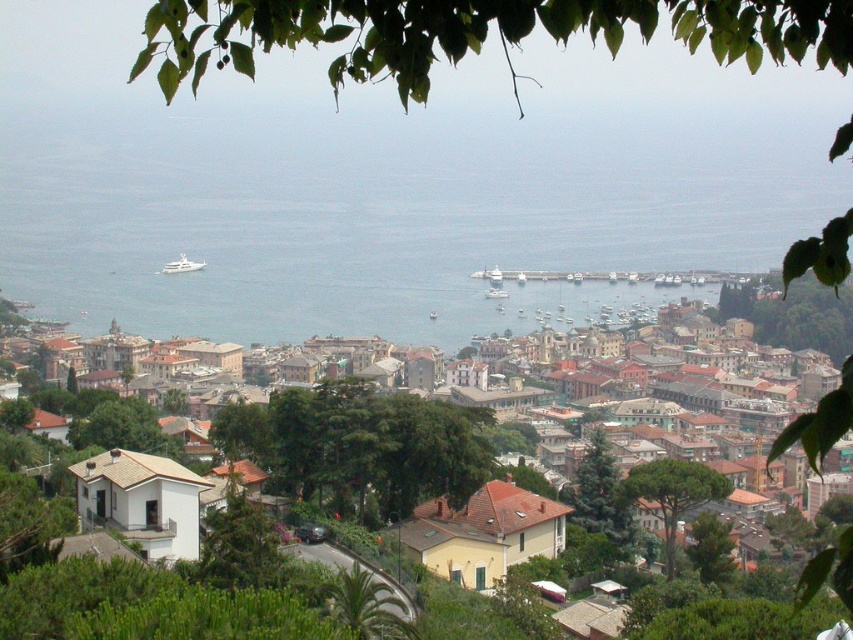
Question: Which of the following is the closest to the observer?

Choices:
 (A) (500, 296)
 (B) (764, 6)

Answer: (B)

Question: Which of the following is the farthest from the observer?

Choices:
 (A) (161, 269)
 (B) (326, 442)
 (C) (729, 484)

Answer: (A)

Question: Does blue water at center have a lesser width compared to green leafy tree at upper center?

Choices:
 (A) yes
 (B) no

Answer: (B)

Question: Can you confirm if white matte building at center is positioned to the left of white glossy boat at center?

Choices:
 (A) yes
 (B) no

Answer: (A)

Question: Which object is positioned farthest from the white glossy yacht at upper center?

Choices:
 (A) green leafy tree at center-right
 (B) green rough bark tree at lower right
 (C) white glossy boat at center
 (D) blue water at center

Answer: (B)

Question: Is green leafy tree at center thinner than white glossy yacht at upper center?

Choices:
 (A) yes
 (B) no

Answer: (B)